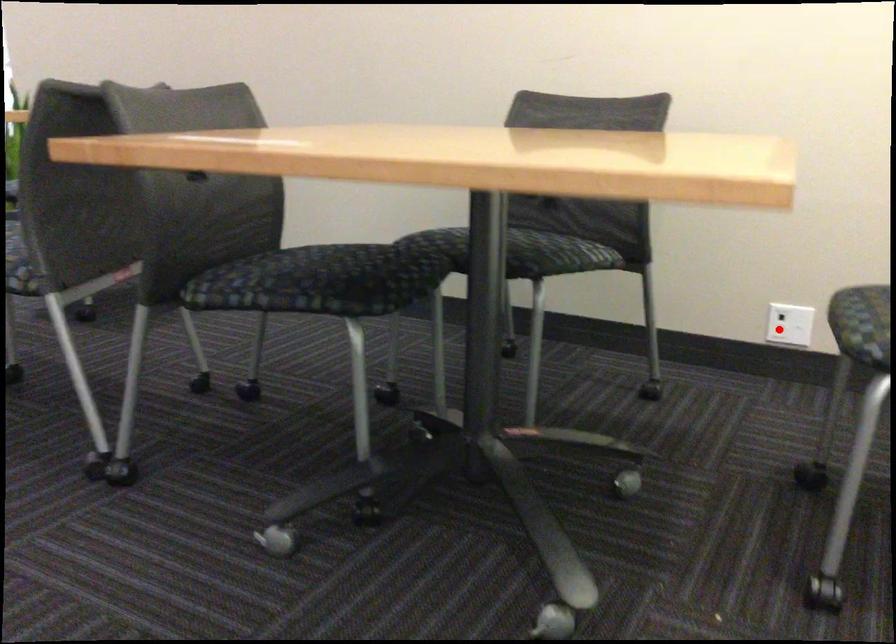
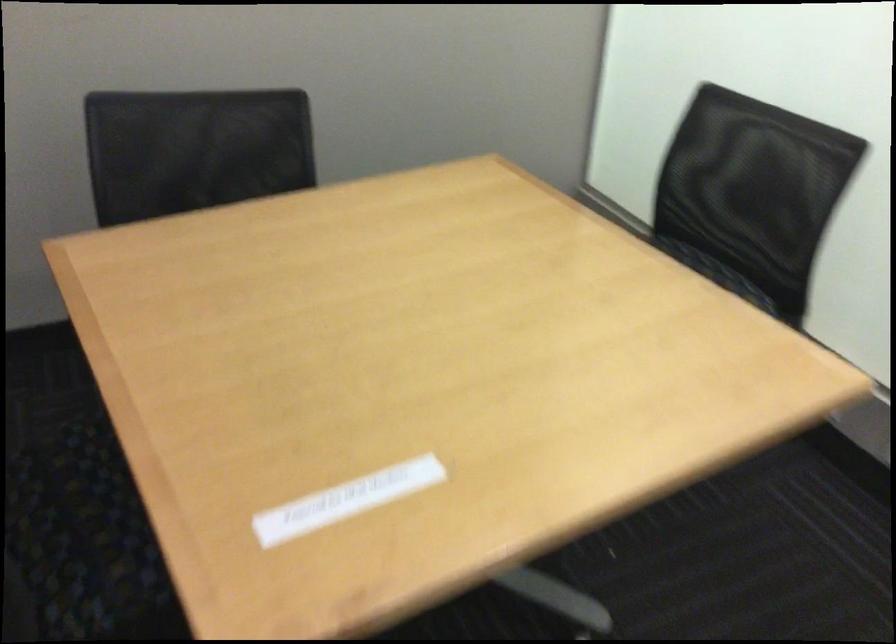
Question: I am providing you with two images of the same scene from different viewpoints. A red point is marked on the first image. At the location where the point appears in image 1, is it still visible in image 2?

Choices:
 (A) Yes
 (B) No

Answer: (B)